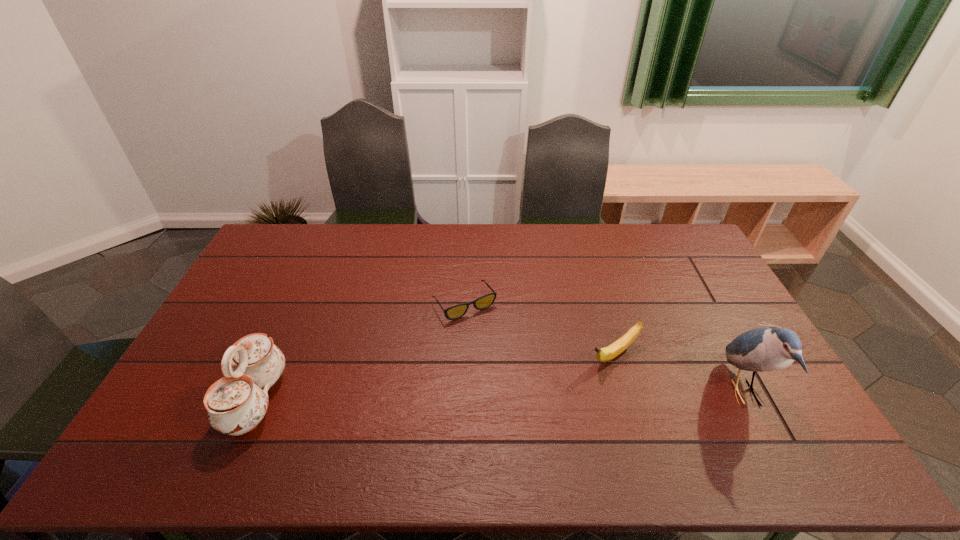
In the image, there is a desktop. Identify the location of free space at the near edge. The height and width of the screenshot is (540, 960). (487, 412).

Identify the location of free location at the left edge. (268, 290).

In the image, there is a desktop. Where is `free space at the right edge`? This screenshot has width=960, height=540. free space at the right edge is located at coordinates (709, 275).

Identify the location of vacant space at the far left corner of the desktop. (280, 250).

I want to click on blank space at the near left corner, so click(202, 424).

Where is `vacant point at the far right corner`? vacant point at the far right corner is located at coordinates (698, 249).

Where is `vacant region between the leftmost object and the bird`? vacant region between the leftmost object and the bird is located at coordinates (500, 396).

You are a GUI agent. You are given a task and a screenshot of the screen. Output one action in this format:
    pyautogui.click(x=<x>, y=<y>)
    Task: Click on the vacant area that lies between the chinaware and the second object from right to left
    This screenshot has width=960, height=540.
    Given the screenshot: What is the action you would take?
    pyautogui.click(x=435, y=377)

Find the location of `free spot between the second shortest object and the bird`. free spot between the second shortest object and the bird is located at coordinates (679, 373).

What are the coordinates of `vacant area that lies between the chinaware and the sunglasses` in the screenshot? It's located at (361, 352).